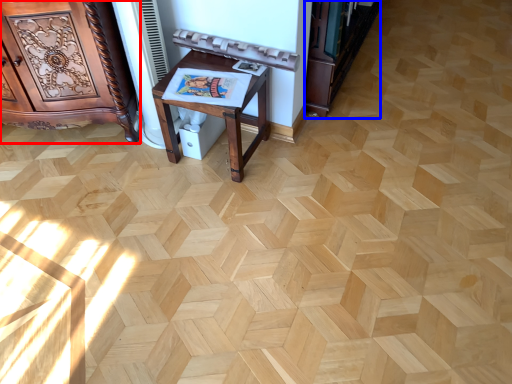
Question: Which of the following is the closest to the observer, furniture (highlighted by a red box) or bookshelf (highlighted by a blue box)?

Choices:
 (A) furniture
 (B) bookshelf

Answer: (A)